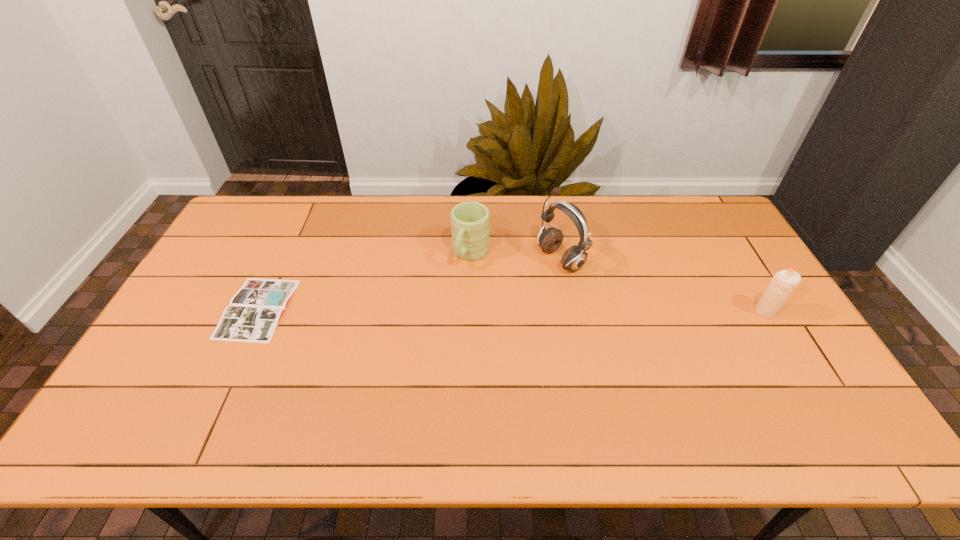
Find the location of a particular element. the shortest object is located at coordinates (254, 312).

Locate an element on the screen. book is located at coordinates (254, 312).

The height and width of the screenshot is (540, 960). I want to click on the third shortest object, so click(x=782, y=284).

Locate an element on the screen. The image size is (960, 540). the rightmost object is located at coordinates (782, 284).

At what (x,y) coordinates should I click in order to perform the action: click on the second object from right to left. Please return your answer as a coordinate pair (x, y). Looking at the image, I should click on (574, 258).

I want to click on the tallest object, so click(x=574, y=258).

Image resolution: width=960 pixels, height=540 pixels. Find the location of `the third object from right to left`. the third object from right to left is located at coordinates (470, 221).

Identify the location of the third tallest object. (470, 221).

I want to click on vacant space positioned 0.370m on the right of the book, so click(x=418, y=308).

This screenshot has width=960, height=540. Identify the location of free space located 0.140m on the front of the rightmost object. [x=795, y=361].